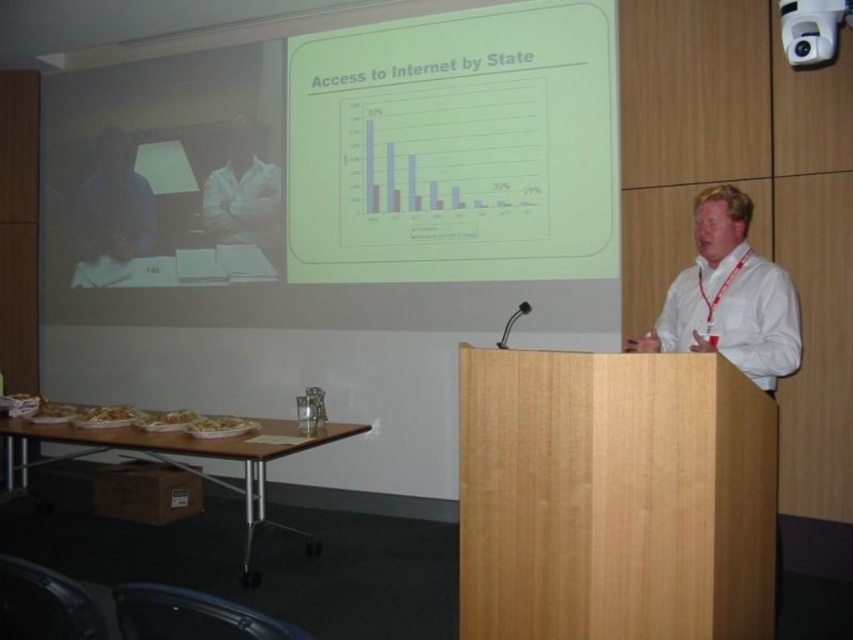
Question: Considering the real-world distances, which object is closest to the wooden podium at lower left?

Choices:
 (A) white matte projection screen at upper center
 (B) white paper plate at lower center
 (C) white plastic projector at upper right
 (D) white shirt at upper center

Answer: (B)

Question: Is white shirt at center positioned in front of white plastic projector at upper right?

Choices:
 (A) no
 (B) yes

Answer: (B)

Question: Among these objects, which one is farthest from the camera?

Choices:
 (A) white shirt at upper center
 (B) white paper plate at lower center
 (C) white shirt at center
 (D) matte blue shirt at upper left

Answer: (D)

Question: Which of the following is the closest to the observer?

Choices:
 (A) (180, 417)
 (B) (244, 419)
 (C) (306, 440)

Answer: (C)

Question: Can you confirm if white shirt at center is smaller than white plastic projector at upper right?

Choices:
 (A) yes
 (B) no

Answer: (B)

Question: Considering the relative positions of white plastic projector at upper right and white glossy pasta at center in the image provided, where is white plastic projector at upper right located with respect to white glossy pasta at center?

Choices:
 (A) above
 (B) below

Answer: (A)